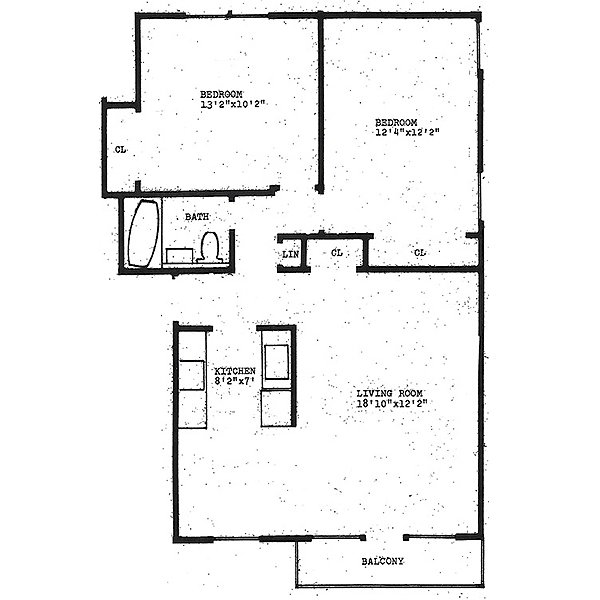
Where is `bathroom`? The width and height of the screenshot is (600, 600). bathroom is located at coordinates (203, 218).